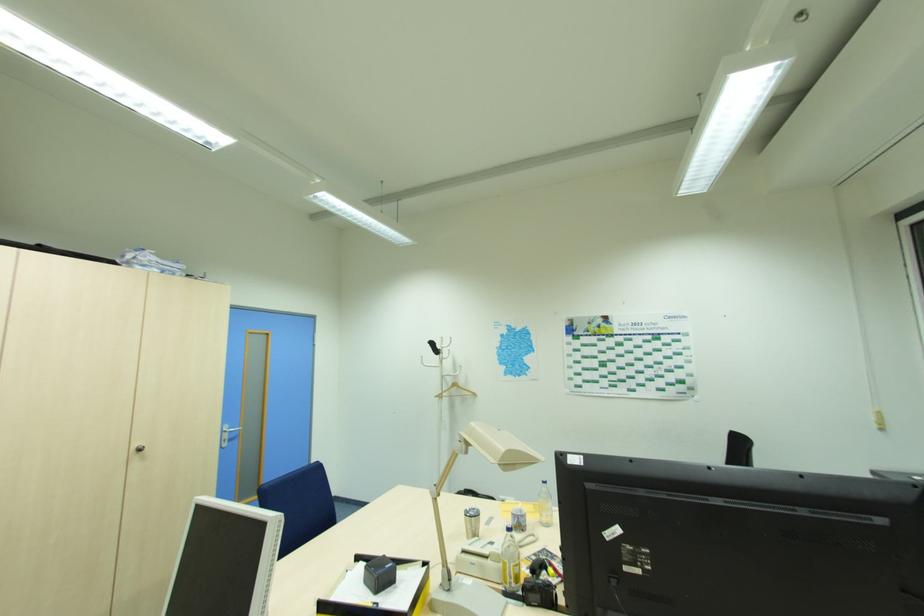
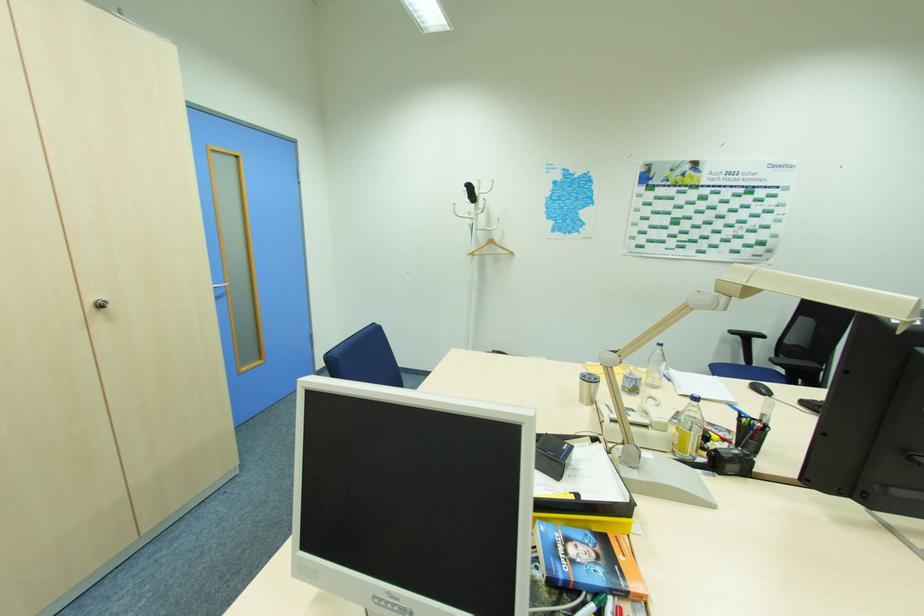
In the second image, find the point that corresponds to [456,374] in the first image.

(492, 229)